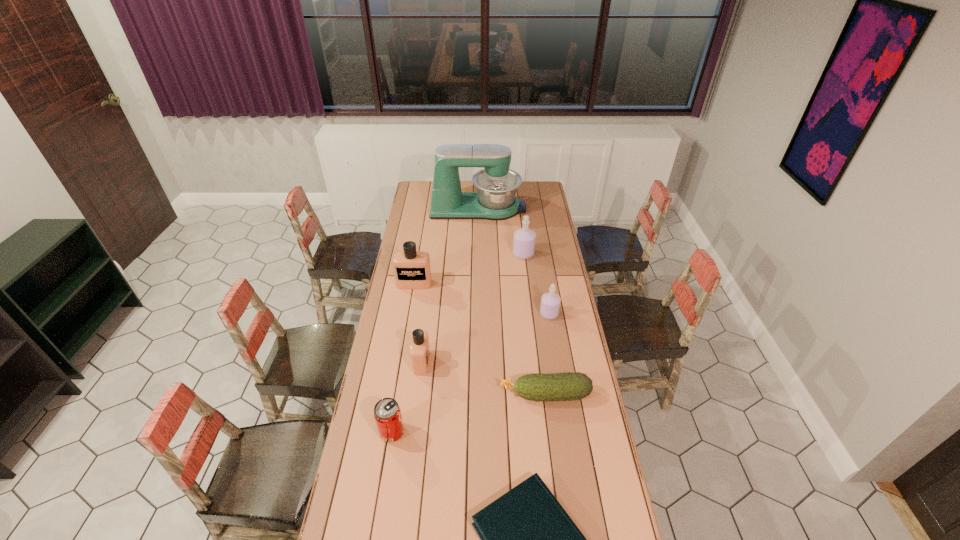
Where is `free space at the far edge`? The width and height of the screenshot is (960, 540). free space at the far edge is located at coordinates (474, 188).

Find the location of `vacant space at the left edge of the desktop`. vacant space at the left edge of the desktop is located at coordinates (394, 350).

This screenshot has height=540, width=960. In the image, there is a desktop. Identify the location of free space at the right edge. (552, 222).

The height and width of the screenshot is (540, 960). I want to click on vacant space at the far left corner, so click(431, 192).

Where is `vacant space at the far right corner of the desktop`? The height and width of the screenshot is (540, 960). vacant space at the far right corner of the desktop is located at coordinates pos(540,190).

Locate an element on the screen. Image resolution: width=960 pixels, height=540 pixels. vacant point located between the second shortest object and the mixer is located at coordinates (512, 301).

The height and width of the screenshot is (540, 960). In order to click on vacant area that lies between the red pop soda and the nearer purple perfume in this screenshot , I will do `click(470, 373)`.

Locate an element on the screen. free space between the nearer beige perfume and the farthest perfume is located at coordinates (472, 308).

What are the coordinates of `free spot between the second nearest object and the bigger purple perfume` in the screenshot? It's located at (458, 343).

Identify the location of unoccupied position between the second nearest perfume and the green cucumber. (547, 354).